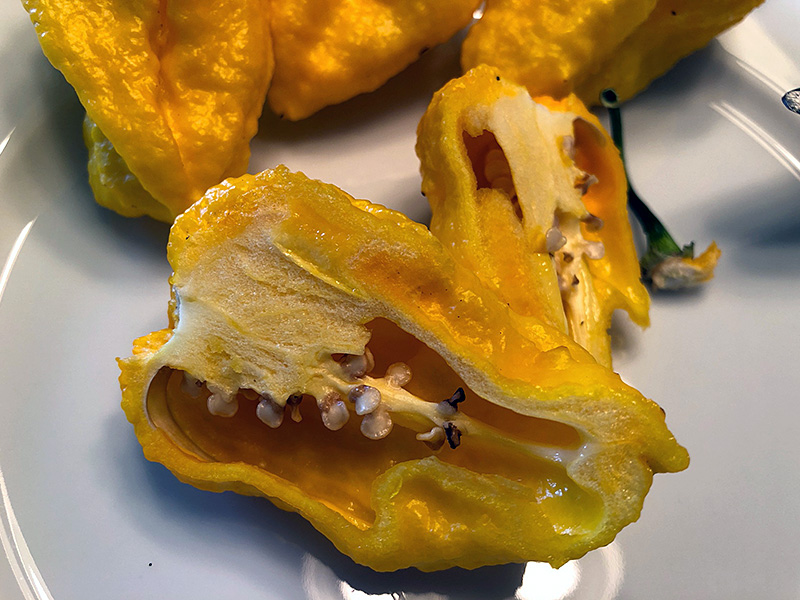
The height and width of the screenshot is (600, 800). Find the location of `rim of gray plate`. rim of gray plate is located at coordinates (768, 44).